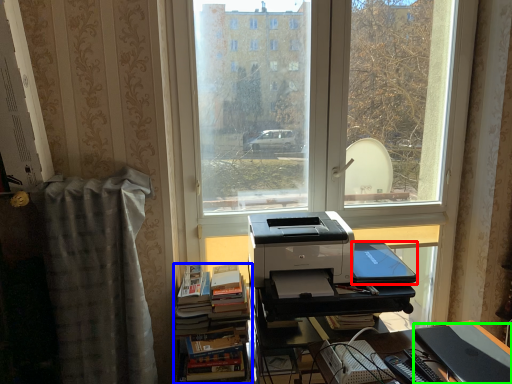
Question: Which object is the closest to the register (highlighted by a red box)? Choose among these: book (highlighted by a blue box) or register (highlighted by a green box).

Choices:
 (A) book
 (B) register

Answer: (B)